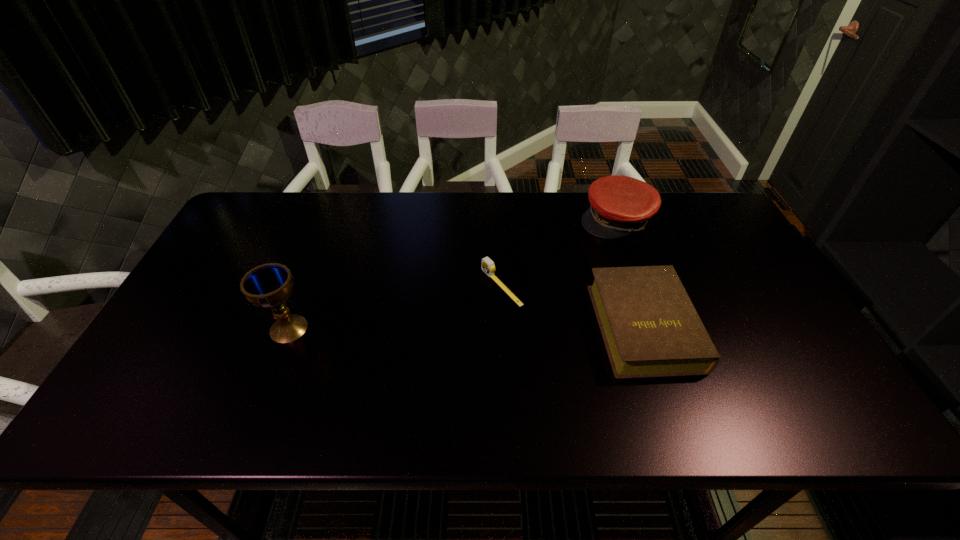
The width and height of the screenshot is (960, 540). Find the location of `vacant space on the desktop that is between the tallest object and the Bible and is positioned at the front of the third object from right to left with the tape extended`. vacant space on the desktop that is between the tallest object and the Bible and is positioned at the front of the third object from right to left with the tape extended is located at coordinates (419, 328).

What are the coordinates of `vacant space on the desktop that is between the tallest object and the second shortest object and is positioned on the front of the cap with an emblem` in the screenshot? It's located at (497, 327).